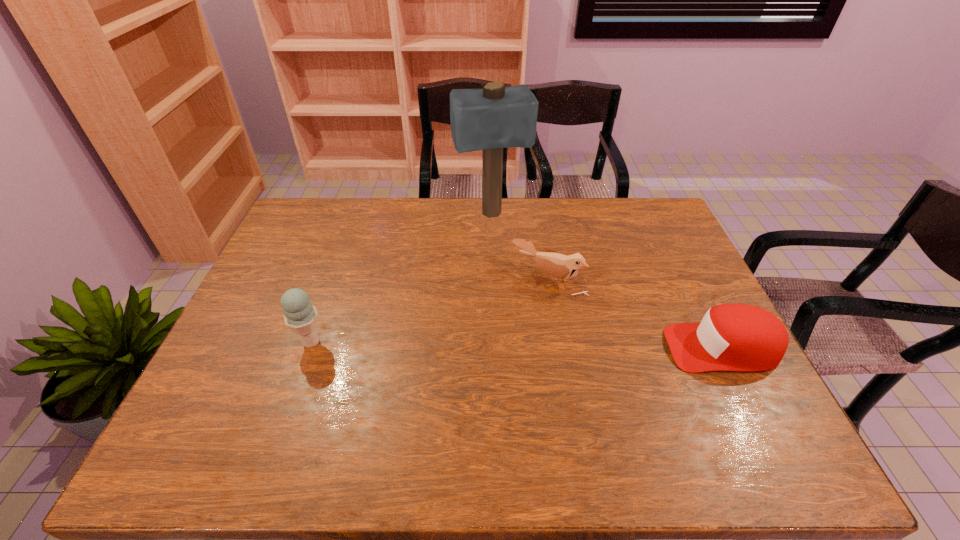
Locate an element on the screen. Image resolution: width=960 pixels, height=540 pixels. vacant space located 0.270m on the striking surface of the tallest object is located at coordinates (514, 282).

This screenshot has height=540, width=960. Find the location of `free spot located on the striking surface of the tallest object`. free spot located on the striking surface of the tallest object is located at coordinates (524, 314).

Where is `free location located on the striking surface of the tallest object`? free location located on the striking surface of the tallest object is located at coordinates (516, 287).

The width and height of the screenshot is (960, 540). In order to click on free space located at the beak of the bird in this screenshot , I will do `click(516, 311)`.

Identify the location of free space located at the beak of the bird. The height and width of the screenshot is (540, 960). (448, 393).

Where is `free spot located 0.110m at the beak of the bird`? The width and height of the screenshot is (960, 540). free spot located 0.110m at the beak of the bird is located at coordinates (511, 318).

Locate an element on the screen. This screenshot has width=960, height=540. object that is positioned at the far edge is located at coordinates (495, 117).

Image resolution: width=960 pixels, height=540 pixels. I want to click on object positioned at the right edge, so tap(731, 337).

Where is `vacant position at the far edge of the desktop`? Image resolution: width=960 pixels, height=540 pixels. vacant position at the far edge of the desktop is located at coordinates (351, 233).

At what (x,y) coordinates should I click in order to perform the action: click on free space at the near edge of the desktop. Please return your answer as a coordinate pair (x, y). The height and width of the screenshot is (540, 960). Looking at the image, I should click on (662, 407).